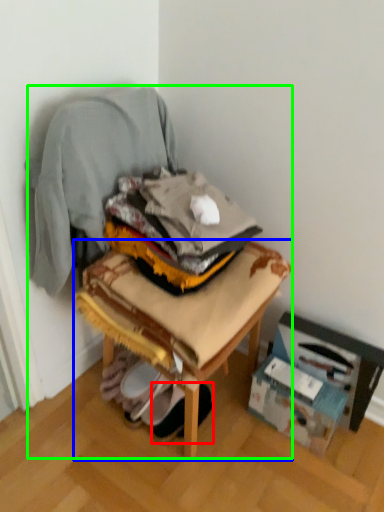
Question: Estimate the real-world distances between objects in this image. Which object is farther from footwear (highlighted by a red box), furniture (highlighted by a blue box) or chair (highlighted by a green box)?

Choices:
 (A) furniture
 (B) chair

Answer: (B)